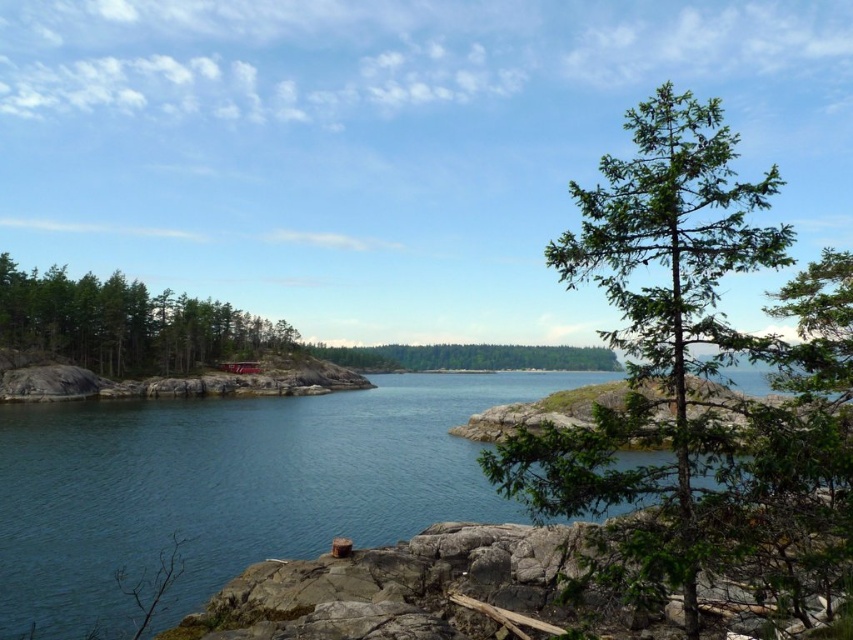
You are an environmental scientist assessing the health of trees in a coastal area. You observe the green leafy tree at center and the green matte tree at left. Which tree might have a smaller trunk diameter based on their appearance?

The green leafy tree at center is thinner than the green matte tree at left, indicating it has a smaller trunk diameter.

You are a hiker who wants to take a photo of both the green leafy tree at center and the green matte tree at left. Which tree should you stand closer to in order to capture both in the same frame?

You should stand closer to the green leafy tree at center because it is smaller than the green matte tree at left, so moving closer to it will help balance their sizes in the photo.

You are standing at the center of the rocky terrain in the foreground and want to reach the blue water at center. Which direction should you head towards?

The blue water at center is located at point (228, 483), so you should head towards the lower right direction to reach it.